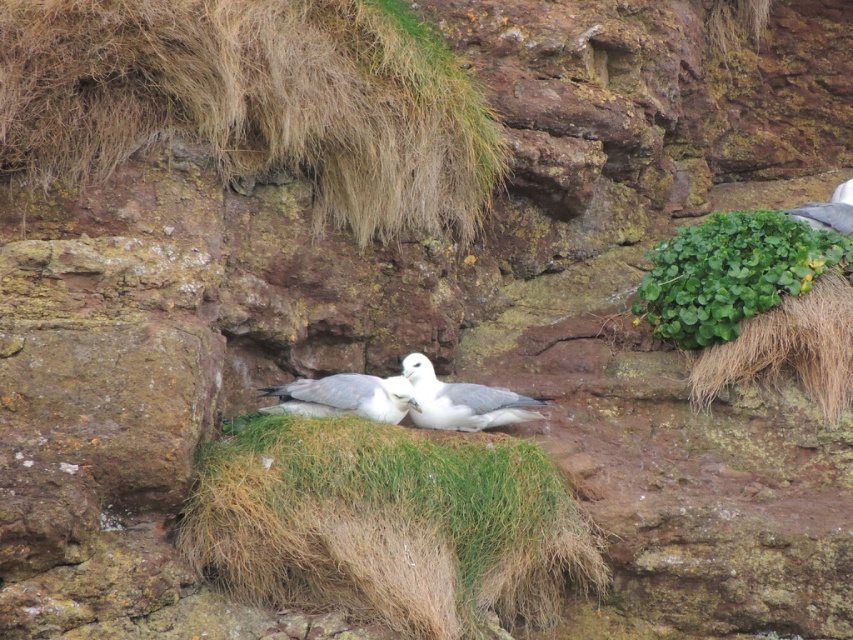
You are a photographer trying to capture both the green leafy plant at upper right and the white matte bird at center in a single frame. Based on their sizes, which object should you focus on first to ensure both are in the frame?

The green leafy plant at upper right is taller than the white matte bird at center, so you should focus on the green leafy plant at upper right first to ensure both are in the frame.

Looking at this image, you are a hiker observing the two birds in the rocky landscape. Which bird is positioned higher up in the image, the white feathered bird at center or the gray feathered bird at upper right?

The gray feathered bird at upper right is positioned higher up in the image than the white feathered bird at center.

You are a photographer aiming to capture both birds in a single frame. The birds are located at point [735,259] and point [467,420]. Which bird should you focus on first to ensure both are in focus?

You should focus on the bird at point [735,259] first because it is closer to the camera than the bird at point [467,420], ensuring both will be in focus when focusing on the closer one.